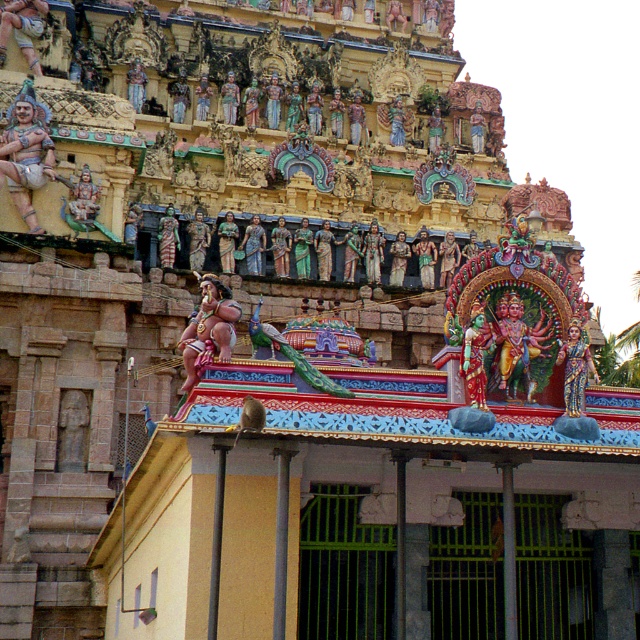
You are an art student examining the temple facade. You notice two statues at the center of the temple structure. The first is a glossy painted statue at center, and the second is a polished bronze statue at center. Which of these two statues appears nearer to you when observing the temple from its front?

The glossy painted statue at center appears nearer because it is closer to the viewer than the polished bronze statue at center.

Based on the temple scene described, where exactly is the golden painted statue at center located in terms of its 2D coordinates?

The golden painted statue at center is located at the 2D coordinates point [576,369].

You are an architect examining the temple facade. You notice a point marked at coordinates (518, 333). What does this point represent?

The point at coordinates (518, 333) indicates the location of a glossy painted statue at center.